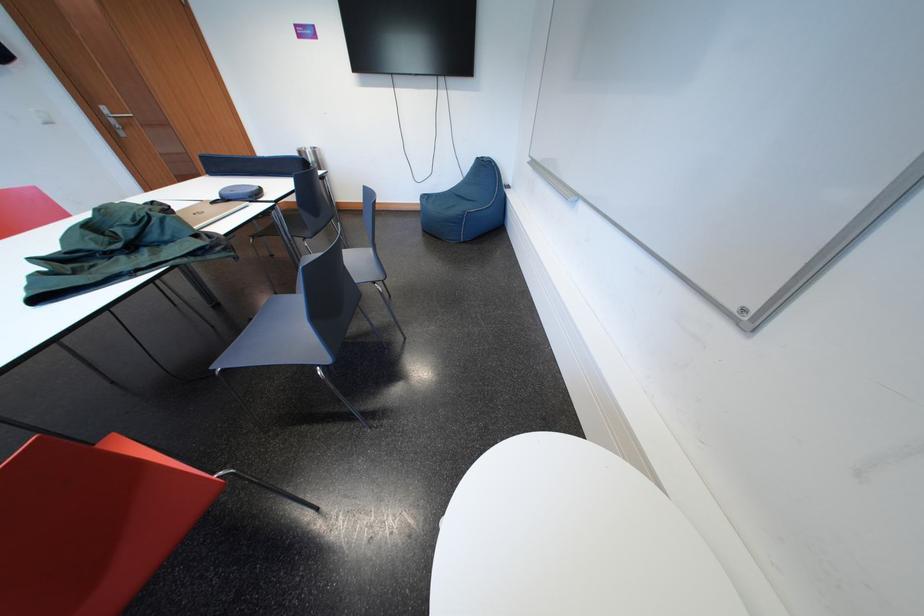
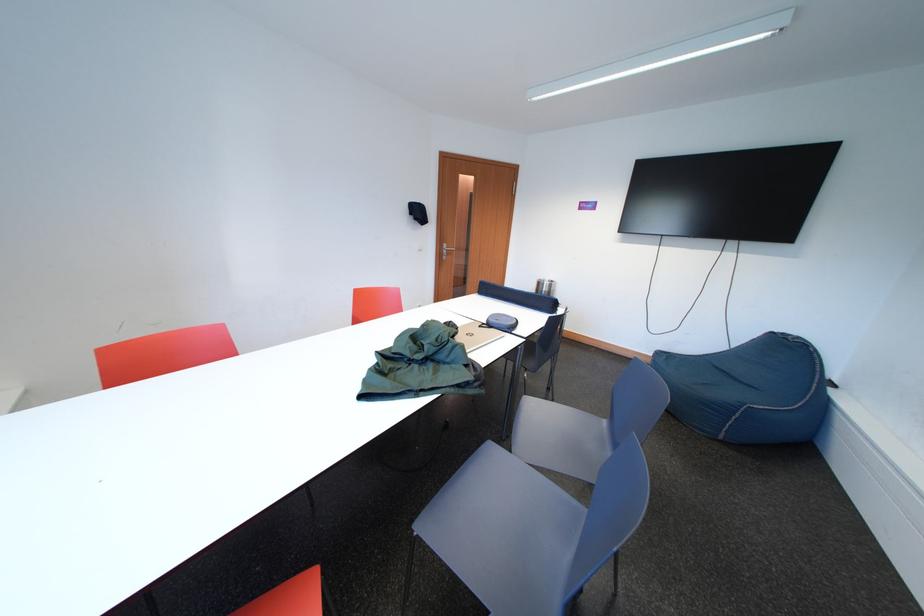
Locate, in the second image, the point that corresponds to [310,158] in the first image.

(549, 288)